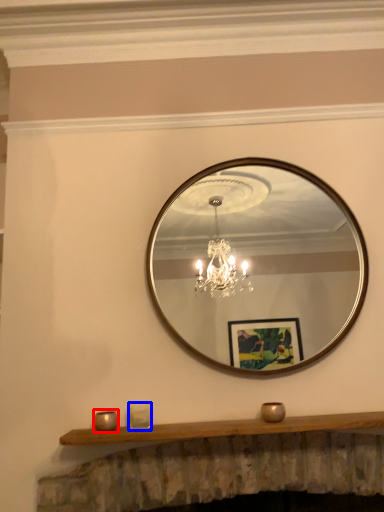
Question: Which object appears farthest to the camera in this image, candle holder (highlighted by a red box) or candle holder (highlighted by a blue box)?

Choices:
 (A) candle holder
 (B) candle holder

Answer: (B)